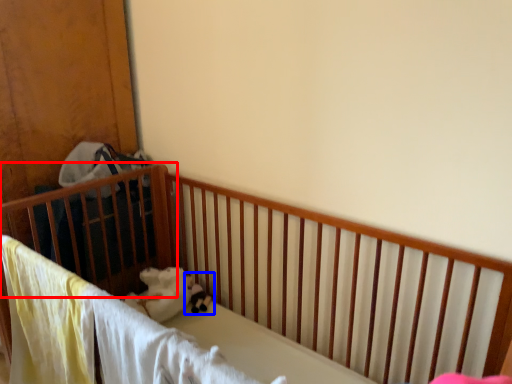
Question: Which point is further to the camera, infant bed (highlighted by a red box) or toy (highlighted by a blue box)?

Choices:
 (A) infant bed
 (B) toy

Answer: (B)